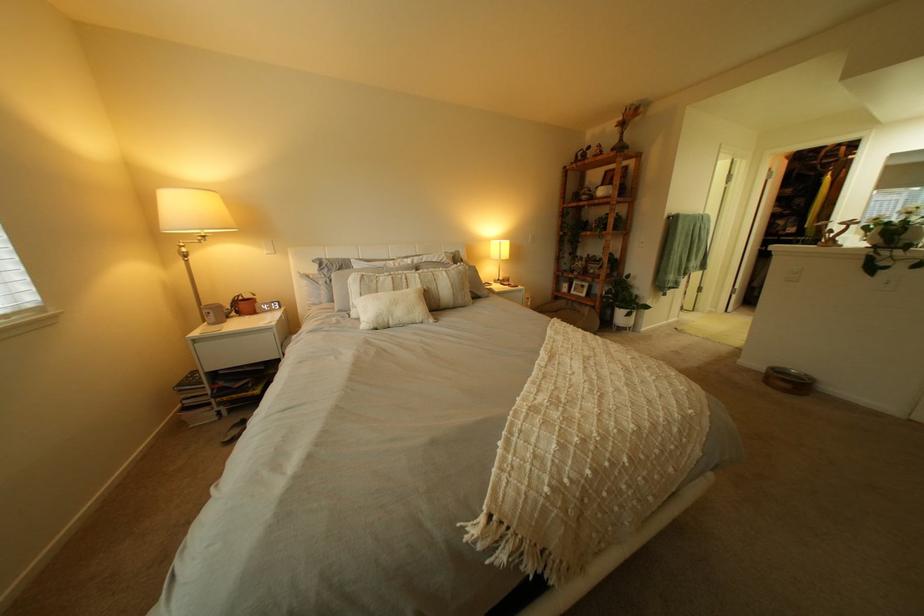
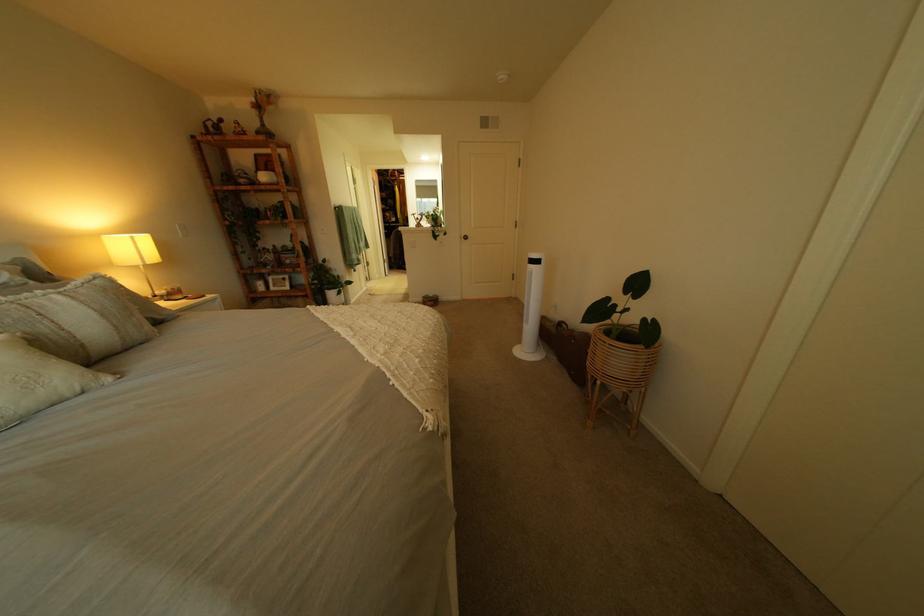
Question: How did the camera likely rotate?

Choices:
 (A) Left
 (B) Right
 (C) Up
 (D) Down

Answer: (B)